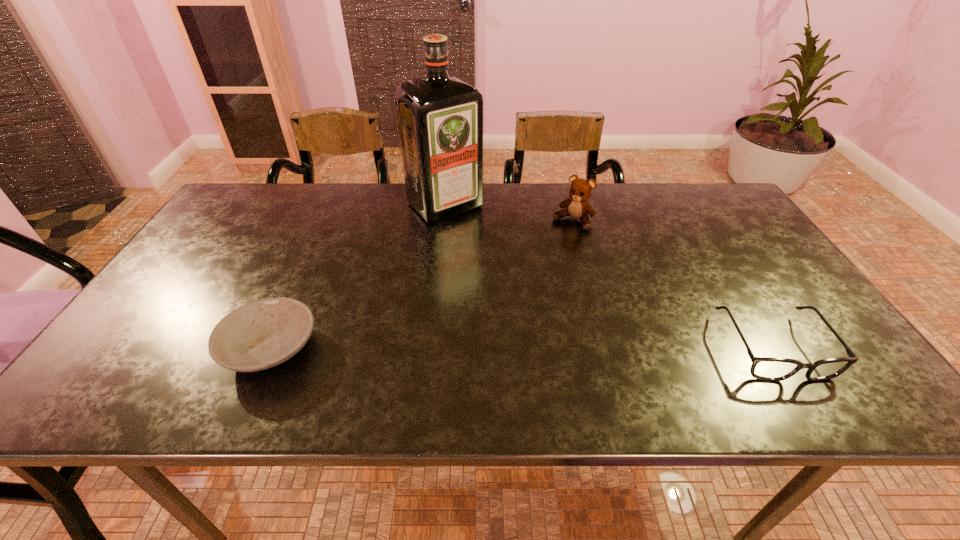
Locate an element on the screen. The height and width of the screenshot is (540, 960). free space at the near edge is located at coordinates (639, 336).

This screenshot has height=540, width=960. I want to click on free space at the left edge, so click(x=194, y=335).

The width and height of the screenshot is (960, 540). In the image, there is a desktop. What are the coordinates of `vacant space at the right edge` in the screenshot? It's located at (736, 241).

In order to click on vacant point at the near left corner in this screenshot , I will do point(110,353).

Locate an element on the screen. Image resolution: width=960 pixels, height=540 pixels. free spot between the third shortest object and the leftmost object is located at coordinates (422, 285).

The image size is (960, 540). In order to click on vacant space that's between the liquor and the rightmost object in this screenshot , I will do `click(609, 276)`.

This screenshot has width=960, height=540. What are the coordinates of `empty location between the rightmost object and the second object from left to right` in the screenshot? It's located at coord(609,276).

Where is `blank region between the tallest object and the bowl`? blank region between the tallest object and the bowl is located at coordinates (358, 277).

The image size is (960, 540). Identify the location of free space between the spectacles and the third shortest object. (673, 284).

Identify the location of free area in between the rightmost object and the tallest object. The height and width of the screenshot is (540, 960). (609, 276).